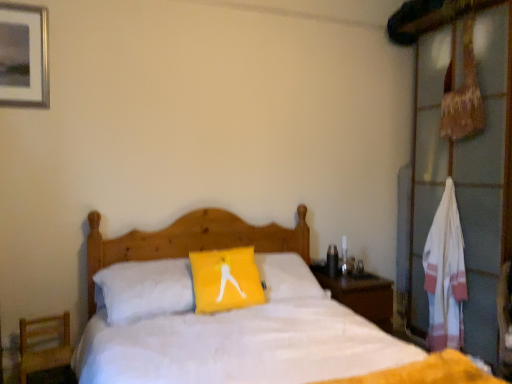
Question: Considering the positions of white striped towel at right and metallic silver picture frame at upper left in the image, is white striped towel at right wider or thinner than metallic silver picture frame at upper left?

Choices:
 (A) wide
 (B) thin

Answer: (A)

Question: From the image's perspective, is white striped towel at right located above or below metallic silver picture frame at upper left?

Choices:
 (A) above
 (B) below

Answer: (B)

Question: Which object is positioned closest to the wooden bed at center?

Choices:
 (A) wooden chair at lower left
 (B) wooden nightstand at right
 (C) yellow fabric pillow at center
 (D) metallic silver picture frame at upper left
 (E) white wood dresser at right

Answer: (C)

Question: Which object is the farthest from the white wood dresser at right?

Choices:
 (A) metallic silver picture frame at upper left
 (B) wooden nightstand at right
 (C) white striped towel at right
 (D) yellow fabric pillow at center
 (E) wooden bed at center

Answer: (A)